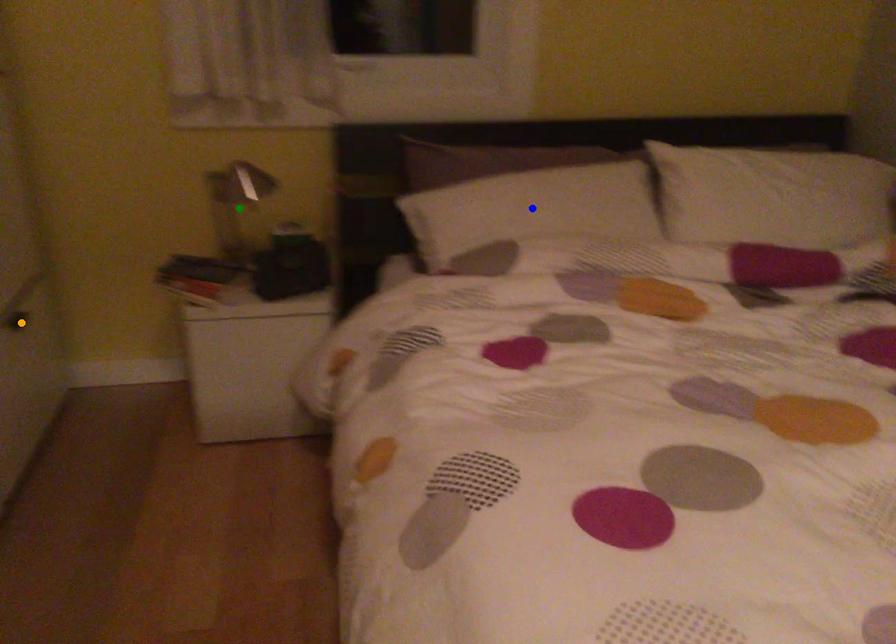
Consider the image. Order these from nearest to farthest:
- green point
- orange point
- blue point

blue point
orange point
green point